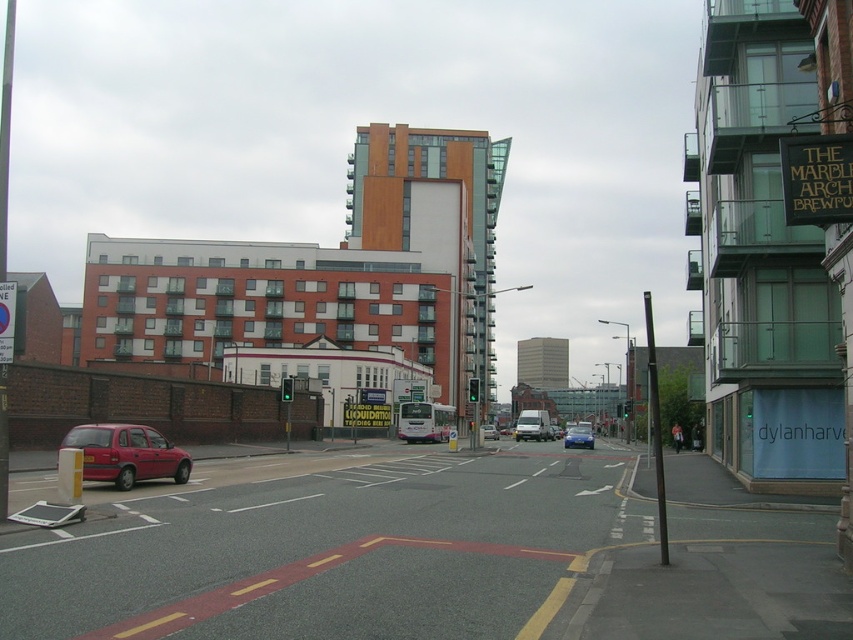
You are a delivery driver who needs to park your van near the blue metallic sedan at center. The parking spot you want is 2 meters away from the sedan. Is the parking spot within a safe distance for your van, considering the sedan is at point 0.684, 0.679?

The blue metallic sedan at center is located at point (x=578, y=436). Since the parking spot is 2 meters away, the van can safely park there as the distance is appropriate for vehicle maneuvering.

You are a delivery person standing at the point with coordinates point (577, 436). You need to deliver a package to the point with coordinates point (155, 442). Can you see the delivery location from your current position?

Since point (155, 442) is in front of point (577, 436), you can see the delivery location from your current position.

You are a delivery driver who needs to park your vehicle between the two matte red cars. Given that your delivery van is 5 meters long, can you safely park between the matte red car at lower left and the matte red car at center without overlapping them?

The matte red car at lower left is smaller than the matte red car at center. However, the exact distance between them isn